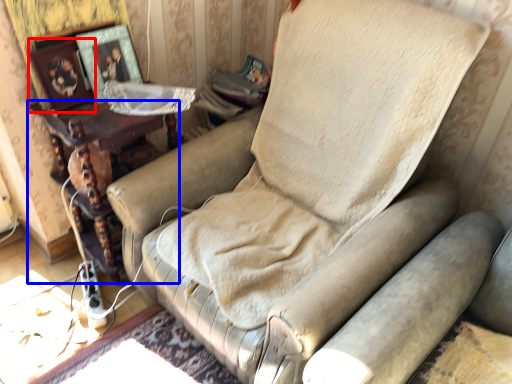
Question: Which object appears farthest to the camera in this image, picture frame (highlighted by a red box) or furniture (highlighted by a blue box)?

Choices:
 (A) picture frame
 (B) furniture

Answer: (B)